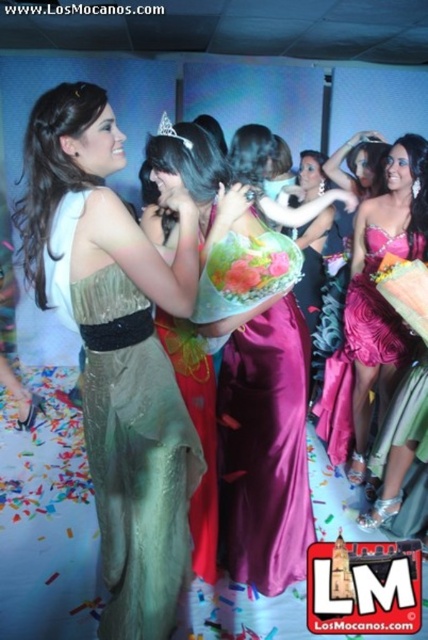
You are a photographer at the event and want to capture a photo of the satin gold dress at center and the clear crystal tiara at upper center. Which object should you focus on first if you want to include both in the frame without moving the camera?

The satin gold dress at center is positioned on the left side of clear crystal tiara at upper center, so you should focus on the satin gold dress at center first to ensure both are in the frame without moving the camera.

You are a photographer at the event and want to capture a closeup of the satin gold dress at center. According to the coordinates provided, where should you aim your camera?

The satin gold dress at center is located at coordinates point (134, 456), so you should aim your camera there.

You are a photographer at the event and want to capture a photo of both the shiny satin dress at center and the silky purple dress at center. Which dress should you focus on first to ensure both are in the frame?

The shiny satin dress at center is in front of the silky purple dress at center, so you should focus on the silky purple dress at center first to ensure both are in the frame.